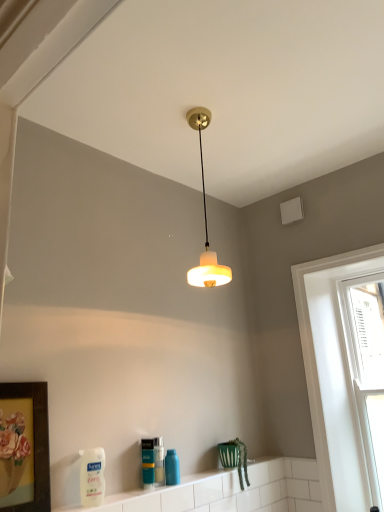
Question: Could you tell me if white matte bottle at lower left, arranged as the first cleaning product when viewed from the left, is facing wooden framed artwork at lower left?

Choices:
 (A) yes
 (B) no

Answer: (B)

Question: Is white matte bottle at lower left, arranged as the first cleaning product when viewed from the left, taller than wooden framed artwork at lower left?

Choices:
 (A) no
 (B) yes

Answer: (A)

Question: Is the depth of white matte bottle at lower left, arranged as the first cleaning product when viewed from the left, greater than that of wooden framed artwork at lower left?

Choices:
 (A) no
 (B) yes

Answer: (B)

Question: Is white matte bottle at lower left, arranged as the first cleaning product when viewed from the left, not inside wooden framed artwork at lower left?

Choices:
 (A) no
 (B) yes

Answer: (B)

Question: From a real-world perspective, does white matte bottle at lower left, acting as the 2th cleaning product starting from the right, stand above wooden framed artwork at lower left?

Choices:
 (A) no
 (B) yes

Answer: (A)

Question: Is white glossy window at right, the 1th window from the left, inside or outside of white glass window at right, the 1th window from the right?

Choices:
 (A) outside
 (B) inside

Answer: (A)

Question: In the image, is white glossy window at right, the 1th window from the left, on the left side or the right side of white glass window at right, the 1th window from the right?

Choices:
 (A) right
 (B) left

Answer: (B)

Question: From a real-world perspective, is white glossy window at right, the 2th window from the right, physically located above or below white glass window at right, the 2th window from the left?

Choices:
 (A) above
 (B) below

Answer: (A)

Question: Considering the positions of white glossy window at right, the 1th window from the left, and white glass window at right, the 2th window from the left, in the image, is white glossy window at right, the 1th window from the left, wider or thinner than white glass window at right, the 2th window from the left,?

Choices:
 (A) wide
 (B) thin

Answer: (B)

Question: Considering the positions of translucent plastic bottle at lower center and white matte bottle at lower left, which appears as the first cleaning product when viewed from the front, in the image, is translucent plastic bottle at lower center taller or shorter than white matte bottle at lower left, which appears as the first cleaning product when viewed from the front,?

Choices:
 (A) short
 (B) tall

Answer: (A)

Question: Is translucent plastic bottle at lower center to the left or to the right of white matte bottle at lower left, arranged as the first cleaning product when viewed from the left, in the image?

Choices:
 (A) left
 (B) right

Answer: (B)

Question: From a real-world perspective, is translucent plastic bottle at lower center positioned above or below white matte bottle at lower left, arranged as the second cleaning product when viewed from the back?

Choices:
 (A) below
 (B) above

Answer: (A)

Question: From the image's perspective, is translucent plastic bottle at lower center above or below white matte bottle at lower left, which appears as the first cleaning product when viewed from the front?

Choices:
 (A) below
 (B) above

Answer: (A)

Question: Considering their positions, is white glossy window at right, the 1th window from the left, located in front of or behind blue glossy bottle at lower center, the 2th cleaning product from the front?

Choices:
 (A) behind
 (B) front

Answer: (B)

Question: Looking at the image, does white glossy window at right, the 2th window from the right, seem bigger or smaller compared to blue glossy bottle at lower center, positioned as the first cleaning product in back-to-front order?

Choices:
 (A) small
 (B) big

Answer: (B)